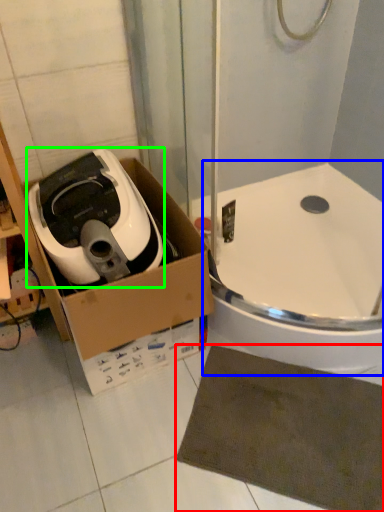
Question: Estimate the real-world distances between objects in this image. Which object is closer to bath mat (highlighted by a red box), bath (highlighted by a blue box) or home appliance (highlighted by a green box)?

Choices:
 (A) bath
 (B) home appliance

Answer: (A)